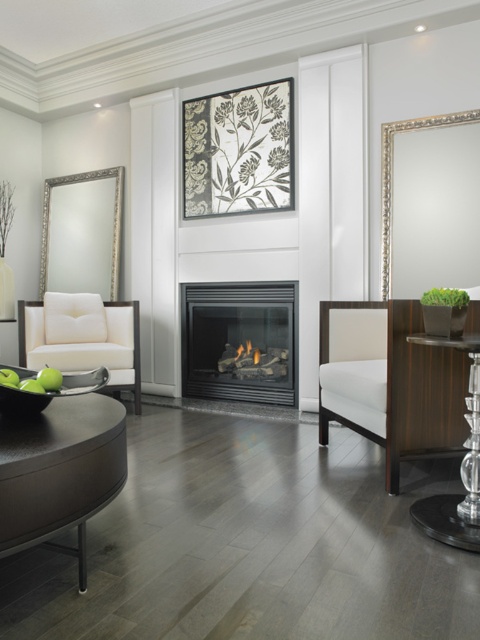
Question: Does dark brown wooden table at lower left have a smaller size compared to black textured fabric at upper center?

Choices:
 (A) yes
 (B) no

Answer: (A)

Question: Is black glass fireplace at center wider than clear glass table at lower right?

Choices:
 (A) no
 (B) yes

Answer: (B)

Question: Which of these objects is positioned closest to the matte white armchair at left?

Choices:
 (A) black glass fireplace at center
 (B) dark brown wooden table at lower left
 (C) clear glass table at lower right
 (D) black textured fabric at upper center

Answer: (A)

Question: Which object appears closest to the camera in this image?

Choices:
 (A) black textured fabric at upper center
 (B) black glass fireplace at center
 (C) dark brown wooden table at lower left
 (D) matte white armchair at left

Answer: (C)

Question: Considering the relative positions of dark brown wooden table at lower left and black glass fireplace at center in the image provided, where is dark brown wooden table at lower left located with respect to black glass fireplace at center?

Choices:
 (A) above
 (B) below

Answer: (B)

Question: Based on their relative distances, which object is nearer to the clear glass table at lower right?

Choices:
 (A) matte white armchair at left
 (B) black textured fabric at upper center
 (C) dark brown wooden table at lower left

Answer: (C)